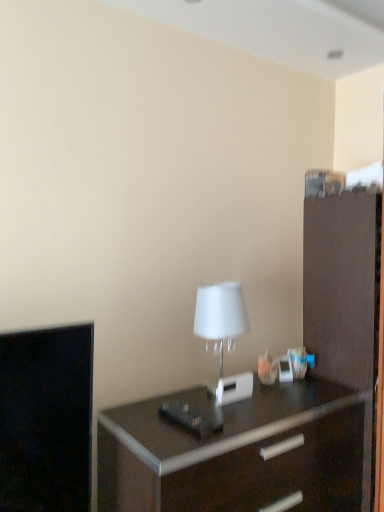
Question: Based on their sizes in the image, would you say dark wood chest of drawers at center is bigger or smaller than brown matte file cabinet at right?

Choices:
 (A) small
 (B) big

Answer: (A)

Question: Considering the positions of dark wood chest of drawers at center and brown matte file cabinet at right in the image, is dark wood chest of drawers at center taller or shorter than brown matte file cabinet at right?

Choices:
 (A) tall
 (B) short

Answer: (B)

Question: Which is farther from the brown matte file cabinet at right?

Choices:
 (A) dark wood chest of drawers at center
 (B) white matte table lamp at center

Answer: (B)

Question: Estimate the real-world distances between objects in this image. Which object is farther from the dark wood chest of drawers at center?

Choices:
 (A) white matte table lamp at center
 (B) brown matte file cabinet at right

Answer: (A)